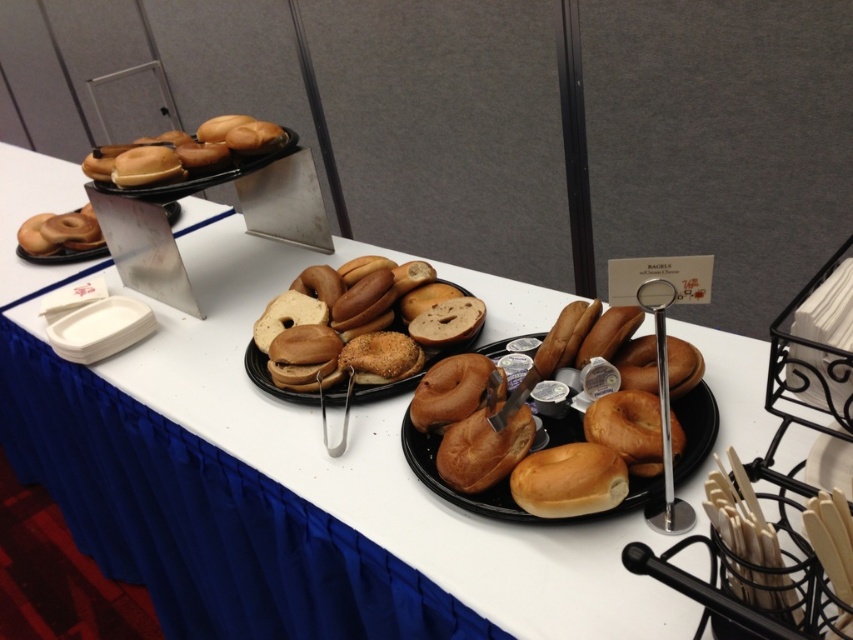
You are at a conference and want to grab a bagel from the table. You see golden brown bagels at center and brown matte bagels at center. Which one is located above the other?

The golden brown bagels at center is positioned under brown matte bagels at center, so the brown matte bagels at center are above.

You are organizing a breakfast event and need to choose between the golden brown bagels at center and the matte black bagel at upper left based on their thickness. Which bagel should you select if you want a thinner option?

The golden brown bagels at center is thinner than the matte black bagel at upper left, so you should select the golden brown bagels at center for a thinner option.

You are organizing a breakfast event and need to arrange the brown matte bagels at center and the matte black bagel at upper left on a shelf. Which bagel should you place on the left side of the shelf to ensure they fit without overlapping?

The brown matte bagels at center has a lesser width compared to the matte black bagel at upper left, so place the brown matte bagels at center on the left side since it is narrower and will fit better without overlapping.